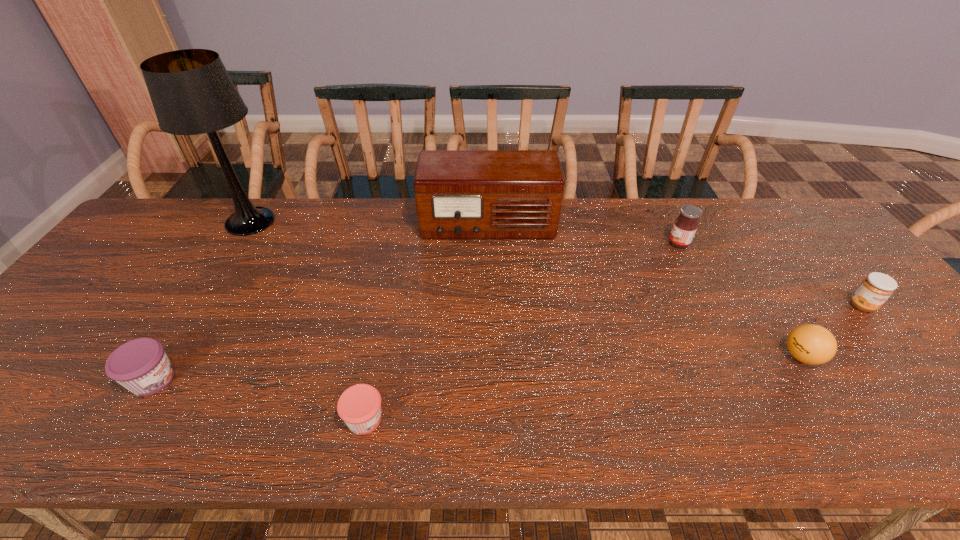
The image size is (960, 540). I want to click on blank region between the table lamp and the sixth object from left to right, so click(526, 289).

Locate an element on the screen. The width and height of the screenshot is (960, 540). vacant area between the fourth nearest object and the second object from right to left is located at coordinates (831, 331).

What are the coordinates of `vacant region between the fifth object from right to left and the third tallest object` in the screenshot? It's located at (521, 331).

Locate an element on the screen. The height and width of the screenshot is (540, 960). object that ranks as the closest to the second farthest jam is located at coordinates (811, 344).

Choose which object is the fifth nearest neighbor to the ping-pong ball. Please provide its 2D coordinates. Your answer should be formatted as a tuple, i.e. [(x, y)], where the tuple contains the x and y coordinates of a point satisfying the conditions above.

[(192, 93)]

Locate which jam is the closest to the shortest jam. Please provide its 2D coordinates. Your answer should be formatted as a tuple, i.e. [(x, y)], where the tuple contains the x and y coordinates of a point satisfying the conditions above.

[(141, 365)]

You are a GUI agent. You are given a task and a screenshot of the screen. Output one action in this format:
    pyautogui.click(x=<x>, y=<y>)
    Task: Click on the jam that is the second closest to the table lamp
    
    Given the screenshot: What is the action you would take?
    pyautogui.click(x=359, y=406)